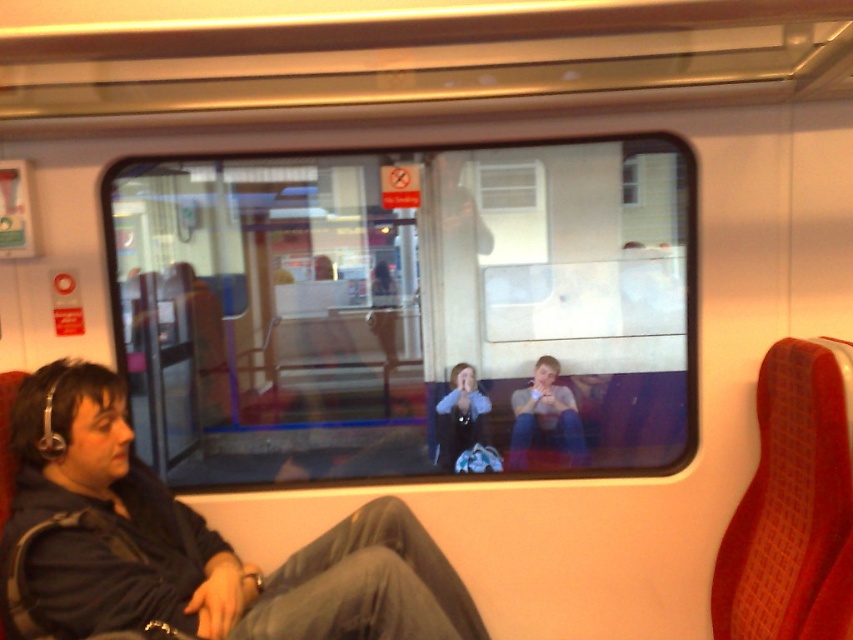
You are a passenger on a train and want to place a 20 inch wide laptop bag between the clear glass window at center and the dark gray fabric coach at lower left. Can the bag fit in the space between them?

The clear glass window at center is 24.44 inches from the dark gray fabric coach at lower left, so yes, the 20 inch wide laptop bag can fit in the space between them since 24.44 inches is greater than 20 inches.

You are a passenger sitting in the train carriage. You want to know if you can place a rectangular book horizontally on the clear glass window at center without it hanging off the edge. The book is as wide as the blue denim jacket at center. Can you do this?

The clear glass window at center is wider than the blue denim jacket at center, so the book, which is as wide as the blue denim jacket at center, will fit on the clear glass window at center without hanging off the edge.

You are sitting in the train carriage and want to see the view outside through the clear glass window at center. However, your blue denim jacket at center is blocking your view. Can you adjust your position to see through the window without moving the jacket?

The clear glass window at center is above the blue denim jacket at center, so you can tilt your head upwards to look over the jacket and see through the window.